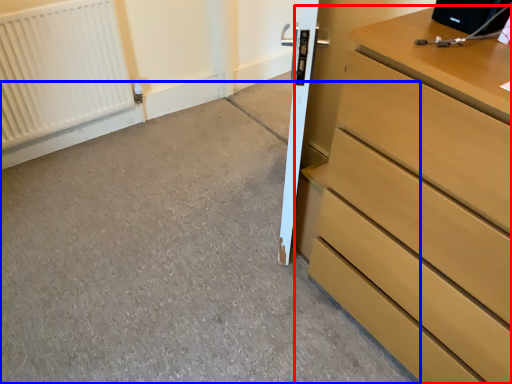
Question: Which object appears closest to the camera in this image, chest of drawers (highlighted by a red box) or concrete (highlighted by a blue box)?

Choices:
 (A) chest of drawers
 (B) concrete

Answer: (A)